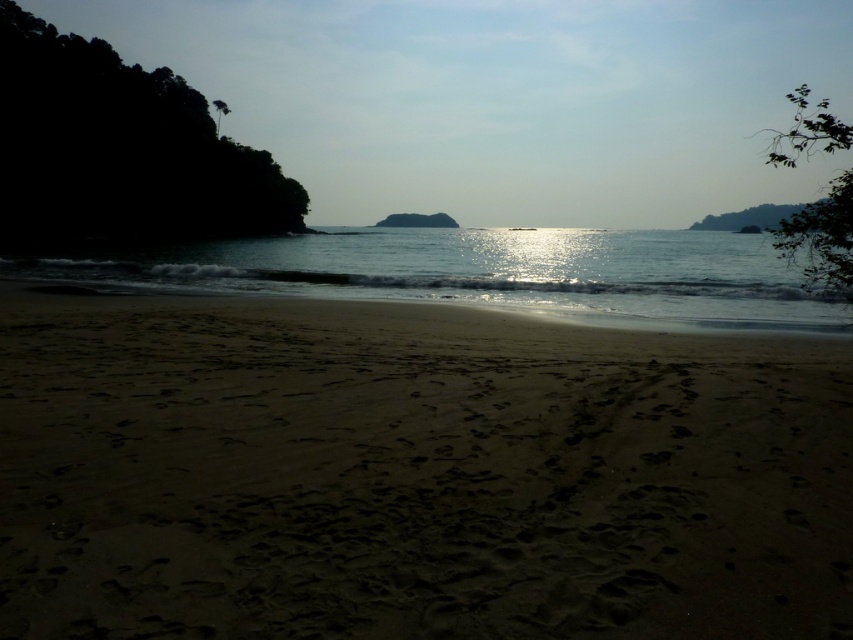
Question: Which of the following is the closest to the observer?

Choices:
 (A) light brown sand at center
 (B) shiny reflective water at center

Answer: (A)

Question: Does light brown sand at center have a lesser width compared to shiny reflective water at center?

Choices:
 (A) no
 (B) yes

Answer: (B)

Question: Which point is farther to the camera?

Choices:
 (A) shiny reflective water at center
 (B) light brown sand at center

Answer: (A)

Question: Can you confirm if light brown sand at center is positioned below shiny reflective water at center?

Choices:
 (A) no
 (B) yes

Answer: (B)

Question: Can you confirm if light brown sand at center is thinner than shiny reflective water at center?

Choices:
 (A) no
 (B) yes

Answer: (B)